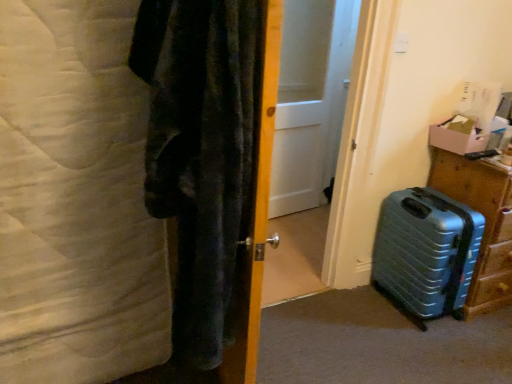
Question: Does white matte door at center lie behind wooden door at center?

Choices:
 (A) yes
 (B) no

Answer: (A)

Question: Does white matte door at center appear on the right side of wooden door at center?

Choices:
 (A) no
 (B) yes

Answer: (B)

Question: From the image's perspective, is white matte door at center located beneath wooden door at center?

Choices:
 (A) yes
 (B) no

Answer: (B)

Question: Can you confirm if white matte door at center is positioned to the left of wooden door at center?

Choices:
 (A) yes
 (B) no

Answer: (B)

Question: From a real-world perspective, is white matte door at center beneath wooden door at center?

Choices:
 (A) no
 (B) yes

Answer: (A)

Question: Would you say white matte door at center is to the left or to the right of cardboard box at right in the picture?

Choices:
 (A) right
 (B) left

Answer: (B)

Question: From their relative heights in the image, would you say white matte door at center is taller or shorter than cardboard box at right?

Choices:
 (A) tall
 (B) short

Answer: (A)

Question: From a real-world perspective, is white matte door at center positioned above or below cardboard box at right?

Choices:
 (A) below
 (B) above

Answer: (A)

Question: In terms of width, does white matte door at center look wider or thinner when compared to cardboard box at right?

Choices:
 (A) thin
 (B) wide

Answer: (A)

Question: From a real-world perspective, is metallic blue suitcase at lower right positioned above or below metallic blue suitcase at lower right?

Choices:
 (A) above
 (B) below

Answer: (B)

Question: From the image's perspective, is metallic blue suitcase at lower right positioned above or below metallic blue suitcase at lower right?

Choices:
 (A) above
 (B) below

Answer: (B)

Question: Based on their positions, is metallic blue suitcase at lower right located to the left or right of metallic blue suitcase at lower right?

Choices:
 (A) right
 (B) left

Answer: (B)

Question: Is point (457, 203) closer or farther from the camera than point (477, 297)?

Choices:
 (A) closer
 (B) farther

Answer: (A)

Question: Is white matte door at center spatially inside wooden door at center, or outside of it?

Choices:
 (A) outside
 (B) inside

Answer: (A)

Question: From their relative heights in the image, would you say white matte door at center is taller or shorter than wooden door at center?

Choices:
 (A) tall
 (B) short

Answer: (A)